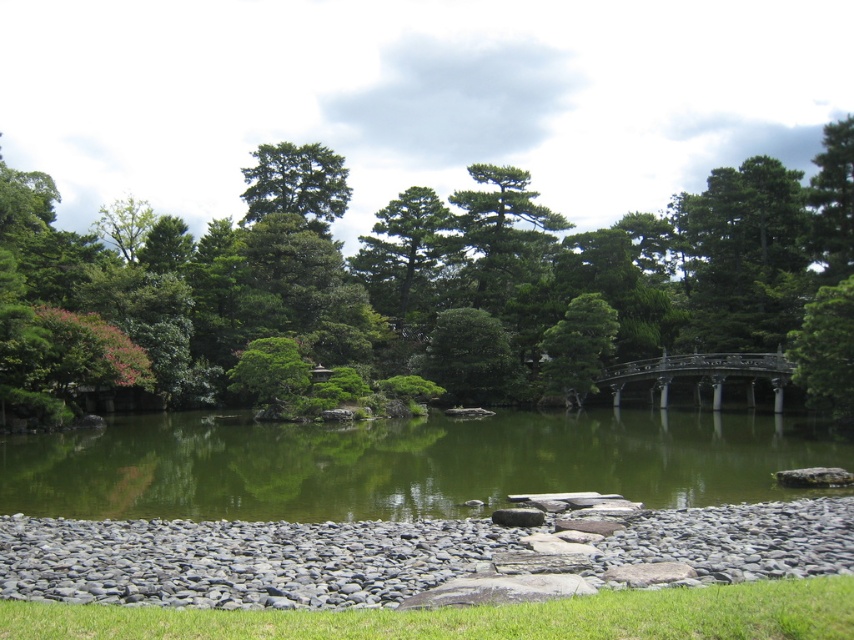
Question: Is green matte tree at upper center wider than dark brown wooden bridge at center right?

Choices:
 (A) no
 (B) yes

Answer: (B)

Question: Which of these objects is positioned closest to the green leafy tree at center?

Choices:
 (A) green smooth water at center
 (B) dark brown wooden bridge at center right

Answer: (A)

Question: Does green matte tree at upper center appear on the right side of dark brown wooden bridge at center right?

Choices:
 (A) no
 (B) yes

Answer: (A)

Question: Among these objects, which one is nearest to the camera?

Choices:
 (A) green textured tree at center
 (B) green matte tree at center
 (C) green leafy tree at center
 (D) green matte tree at upper center

Answer: (C)

Question: Can you confirm if green leafy tree at center is positioned to the right of green matte tree at upper center?

Choices:
 (A) yes
 (B) no

Answer: (A)

Question: Which is nearer to the green matte tree at center?

Choices:
 (A) green smooth water at center
 (B) dark brown wooden bridge at center right

Answer: (B)